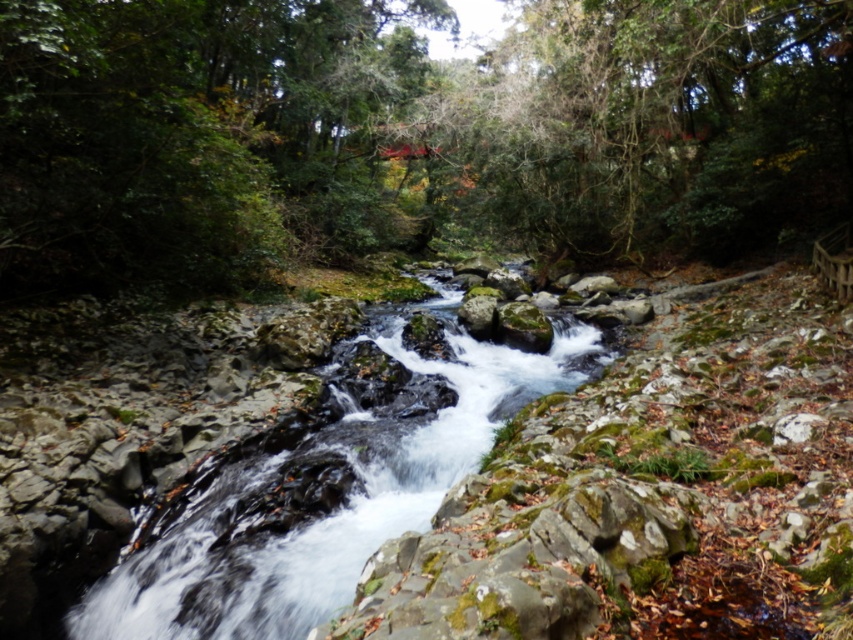
In the scene shown: Can you confirm if green leafy tree at center is positioned to the right of smooth rock stream at center?

Yes, green leafy tree at center is to the right of smooth rock stream at center.

Who is higher up, green leafy tree at center or smooth rock stream at center?

green leafy tree at center is above.

What do you see at coordinates (408, 132) in the screenshot?
I see `green leafy tree at center` at bounding box center [408, 132].

Locate an element on the screen. Image resolution: width=853 pixels, height=640 pixels. green leafy tree at center is located at coordinates (408, 132).

Does smooth rock stream at center have a greater height compared to white smooth rock at center-right?

Yes.

Is smooth rock stream at center smaller than white smooth rock at center-right?

Incorrect, smooth rock stream at center is not smaller in size than white smooth rock at center-right.

Where is `smooth rock stream at center`? The image size is (853, 640). smooth rock stream at center is located at coordinates (337, 509).

Does green leafy tree at center have a lesser height compared to white smooth rock at center-right?

In fact, green leafy tree at center may be taller than white smooth rock at center-right.

Is point (728, 253) positioned before point (784, 422)?

No, it is behind (784, 422).

Identify the location of green leafy tree at center. The image size is (853, 640). (408, 132).

The width and height of the screenshot is (853, 640). I want to click on green leafy tree at center, so click(x=408, y=132).